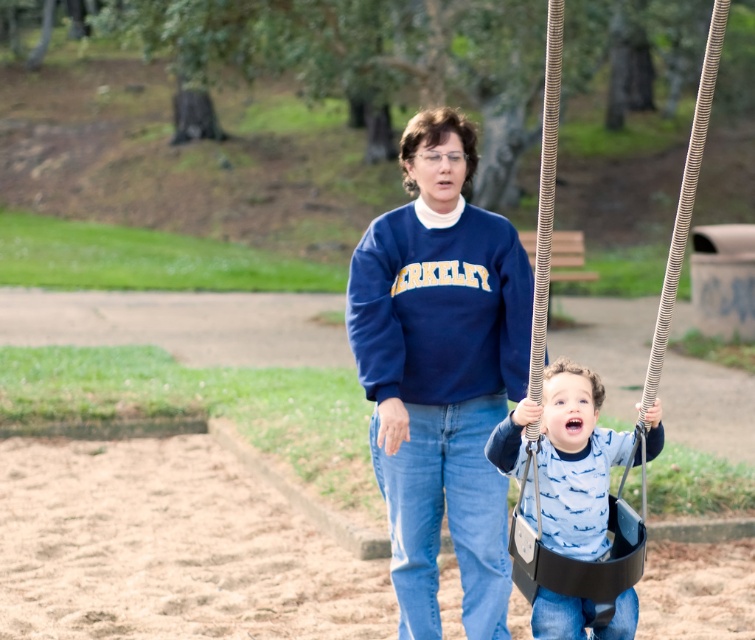
Does black plastic swing at center have a lesser width compared to matte black swing seat at center?

No.

Who is shorter, black plastic swing at center or matte black swing seat at center?

With less height is matte black swing seat at center.

Between point (636, 561) and point (510, 435), which one is positioned in front?

Point (510, 435)

Locate an element on the screen. The height and width of the screenshot is (640, 755). black plastic swing at center is located at coordinates (633, 426).

Does navy blue sweatshirt at center appear on the left side of black plastic swing at center?

Yes, navy blue sweatshirt at center is to the left of black plastic swing at center.

This screenshot has height=640, width=755. In order to click on navy blue sweatshirt at center in this screenshot , I will do `click(441, 372)`.

Locate an element on the screen. The height and width of the screenshot is (640, 755). navy blue sweatshirt at center is located at coordinates (441, 372).

Which of these two, navy blue sweatshirt at center or matte black swing seat at center, stands shorter?

With less height is matte black swing seat at center.

Consider the image. Is navy blue sweatshirt at center in front of matte black swing seat at center?

No, it is behind matte black swing seat at center.

Does point (529, 289) come closer to viewer compared to point (544, 384)?

No.

The width and height of the screenshot is (755, 640). What are the coordinates of `navy blue sweatshirt at center` in the screenshot? It's located at (441, 372).